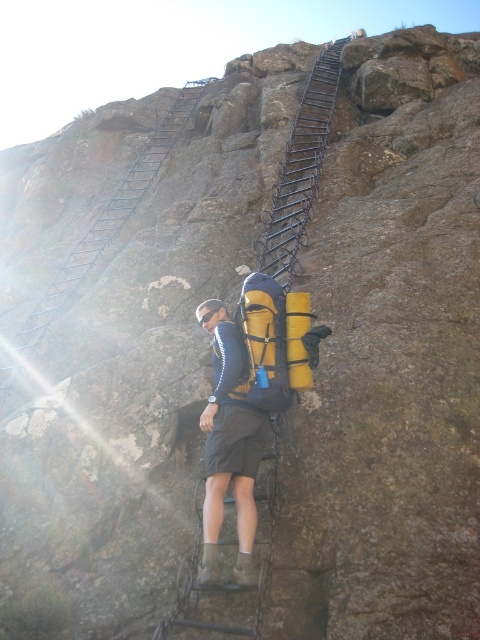
You are a rock climber trying to reach the summit. You see the metallic black ladder at upper center. Where exactly is it located in the image?

The metallic black ladder at upper center is located at point (300, 168) in the image.

You are planning to carry both the matte yellow backpack at center and the yellow matte backpack at center during a hiking trip. Which backpack is taller?

The matte yellow backpack at center is taller than the yellow matte backpack at center.